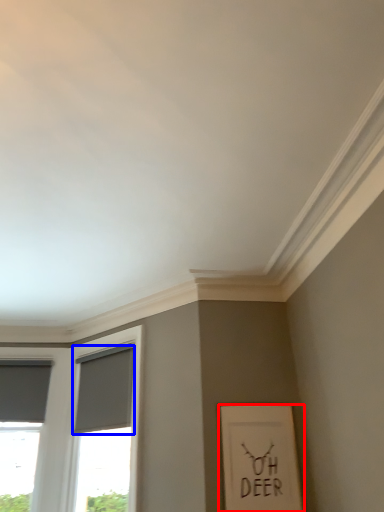
Question: Which object is further to the camera taking this photo, picture frame (highlighted by a red box) or curtain (highlighted by a blue box)?

Choices:
 (A) picture frame
 (B) curtain

Answer: (B)